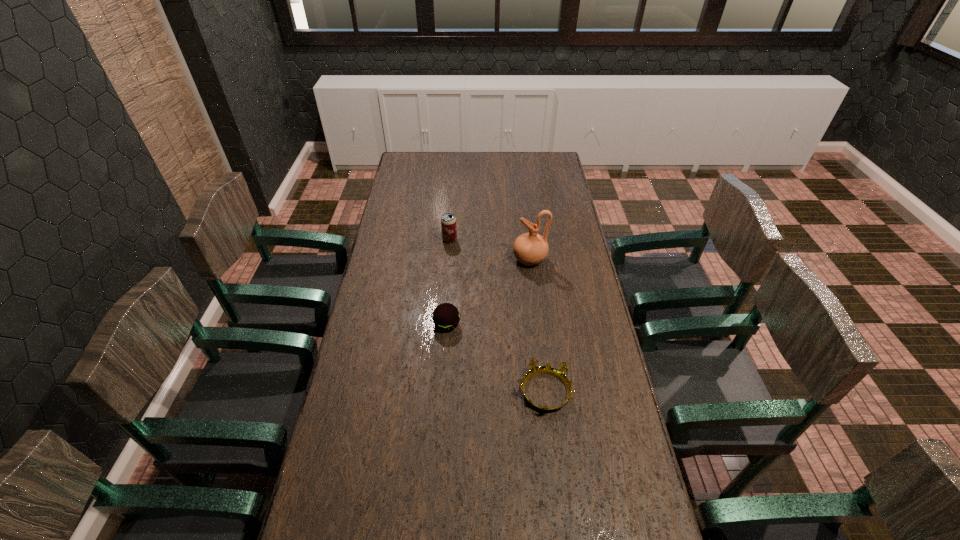
Find the location of a particular element. The image size is (960, 540). free point located 0.200m on the spout of the tallest object is located at coordinates (464, 260).

Find the location of a particular element. vacant space located 0.130m on the right of the beer can is located at coordinates (487, 240).

In order to click on blank area located on the front of the second nearest object in this screenshot , I will do `click(445, 347)`.

Find the location of a particular element. free region located 0.270m on the left of the crown is located at coordinates (430, 392).

Where is `pottery that is positioned at the right edge`? Image resolution: width=960 pixels, height=540 pixels. pottery that is positioned at the right edge is located at coordinates (530, 248).

You are a GUI agent. You are given a task and a screenshot of the screen. Output one action in this format:
    pyautogui.click(x=<x>, y=<y>)
    Task: Click on the crown that is at the right edge
    
    Given the screenshot: What is the action you would take?
    pyautogui.click(x=560, y=373)

I want to click on vacant position at the far edge of the desktop, so click(x=515, y=165).

In the image, there is a desktop. Identify the location of vacant space at the left edge. The width and height of the screenshot is (960, 540). (390, 292).

Locate an element on the screen. free point at the right edge is located at coordinates (549, 208).

The height and width of the screenshot is (540, 960). In order to click on free space at the far left corner of the desktop in this screenshot , I will do `click(420, 153)`.